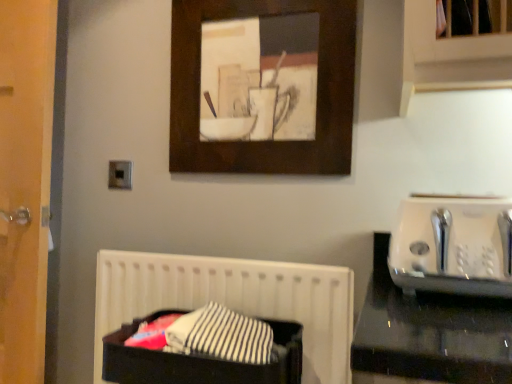
Question: From the image's perspective, is black fabric at lower left beneath metallic silver outlet at upper left?

Choices:
 (A) yes
 (B) no

Answer: (A)

Question: Is black fabric at lower left facing away from metallic silver outlet at upper left?

Choices:
 (A) no
 (B) yes

Answer: (A)

Question: Can you confirm if black fabric at lower left is taller than metallic silver outlet at upper left?

Choices:
 (A) yes
 (B) no

Answer: (A)

Question: Is black fabric at lower left not close to metallic silver outlet at upper left?

Choices:
 (A) no
 (B) yes

Answer: (A)

Question: Can you confirm if black fabric at lower left is positioned to the right of metallic silver outlet at upper left?

Choices:
 (A) yes
 (B) no

Answer: (A)

Question: Would you say black fabric at lower left is outside metallic silver outlet at upper left?

Choices:
 (A) yes
 (B) no

Answer: (A)

Question: From a real-world perspective, is black fabric laundry basket at lower center physically below wooden picture frame at upper center?

Choices:
 (A) no
 (B) yes

Answer: (B)

Question: Does black fabric laundry basket at lower center have a smaller size compared to wooden picture frame at upper center?

Choices:
 (A) yes
 (B) no

Answer: (B)

Question: Is black fabric laundry basket at lower center located outside wooden picture frame at upper center?

Choices:
 (A) yes
 (B) no

Answer: (A)

Question: Does black fabric laundry basket at lower center have a lesser width compared to wooden picture frame at upper center?

Choices:
 (A) yes
 (B) no

Answer: (B)

Question: Could you tell me if black fabric laundry basket at lower center is turned towards wooden picture frame at upper center?

Choices:
 (A) no
 (B) yes

Answer: (A)

Question: Are black fabric laundry basket at lower center and wooden picture frame at upper center located far from each other?

Choices:
 (A) no
 (B) yes

Answer: (A)

Question: Does white plastic toaster at right turn towards wooden picture frame at upper center?

Choices:
 (A) yes
 (B) no

Answer: (B)